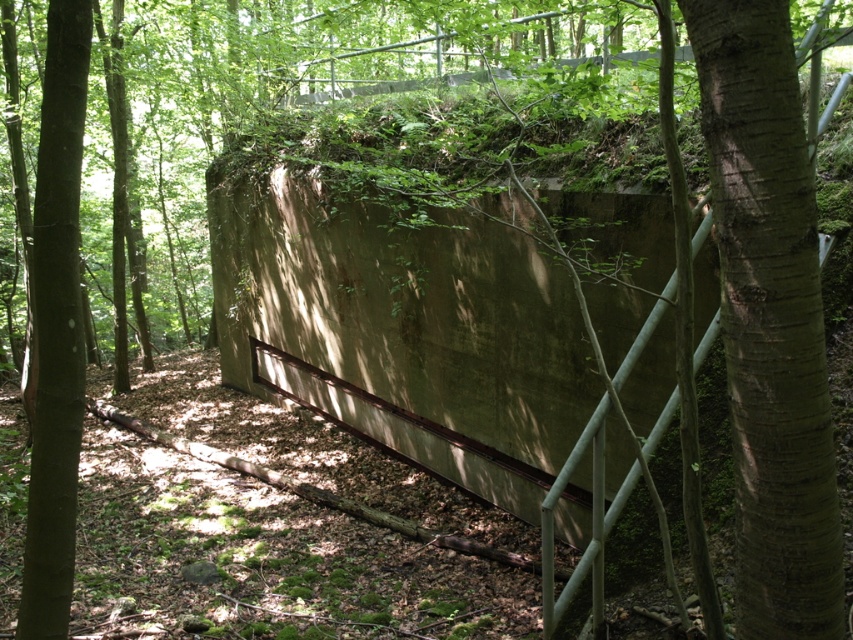
You are a hiker trying to navigate through the forest. You see a green rough bark tree at center right and a brown rough bark tree at left. Which tree is closer to you?

The green rough bark tree at center right is closer to you because it is in front of the brown rough bark tree at left.

From the picture: You are standing in front of the bunker and see the green rough bark tree at center right and the brown rough bark tree at left. Which tree is positioned to the right of the other?

The green rough bark tree at center right is positioned to the right of the brown rough bark tree at left.

You are a hiker who wants to take a photo of the green rough bark tree at center right and the brown rough bark tree at left. Which tree should you stand closer to in order to capture both trees in the same frame without zooming in?

You should stand closer to the green rough bark tree at center right because it is smaller than the brown rough bark tree at left, so being closer will help balance their sizes in the photo.